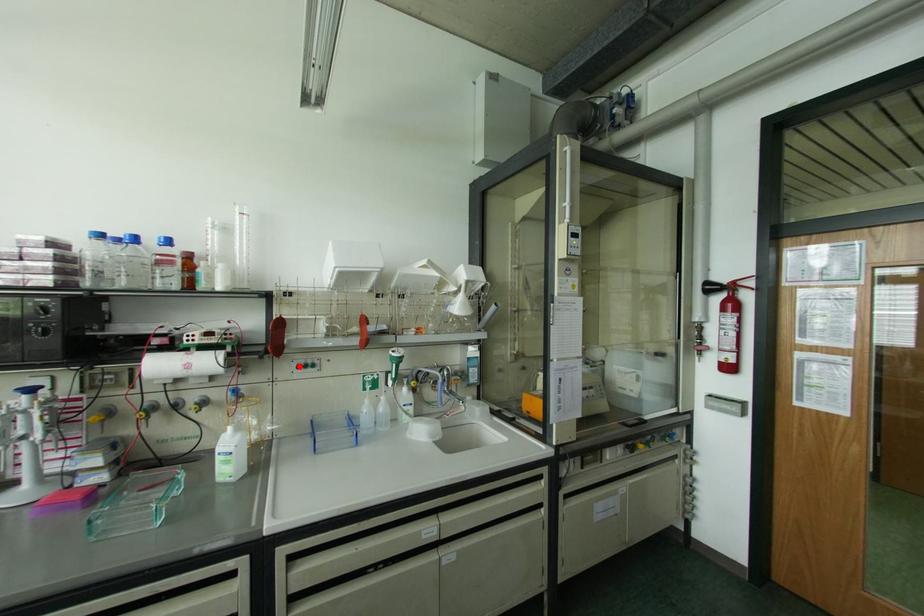
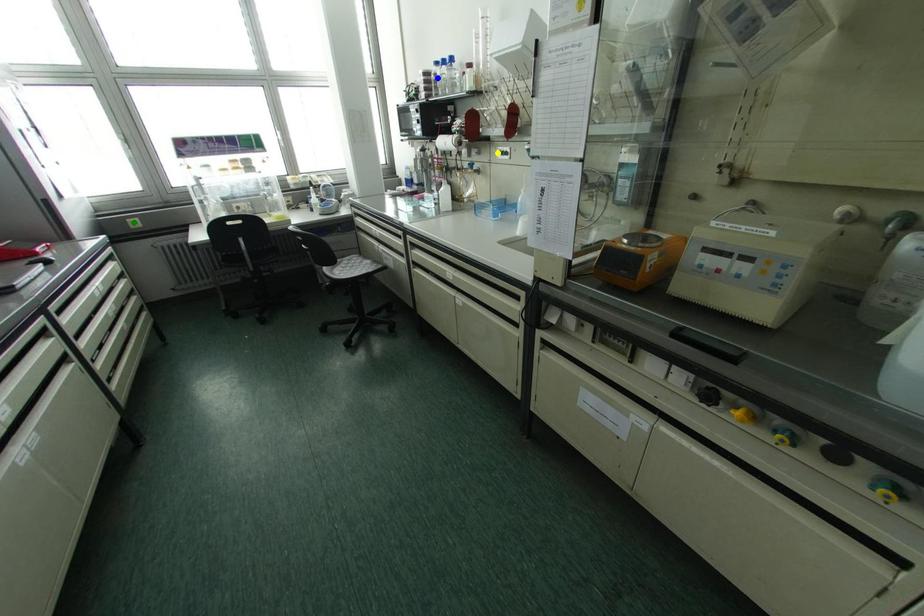
Question: I am providing you with two images of the same scene from different viewpoints. A red point is marked on the first image. You are given multiple points on the second image. Which mark in image 2 goes with the point in image 1?

Choices:
 (A) green point
 (B) blue point
 (C) yellow point

Answer: (C)